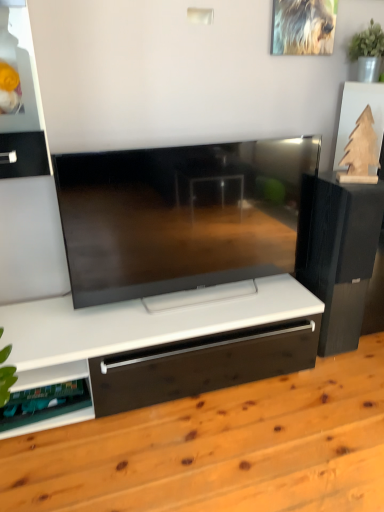
This screenshot has height=512, width=384. I want to click on black matte speaker at right, so click(x=338, y=253).

This screenshot has width=384, height=512. I want to click on black matte speaker at right, so click(x=338, y=253).

Does green plastic shelf at lower left turn towards black matte speaker at right?

No, green plastic shelf at lower left is not aimed at black matte speaker at right.

Between green plastic shelf at lower left and black matte speaker at right, which one has less height?

green plastic shelf at lower left is shorter.

From the image's perspective, is green plastic shelf at lower left above or below black matte speaker at right?

Clearly, from the image's perspective, green plastic shelf at lower left is below black matte speaker at right.

Image resolution: width=384 pixels, height=512 pixels. Identify the location of furniture that is above the green plastic shelf at lower left (from a real-world perspective). (338, 253).

In the scene shown: From a real-world perspective, is wooden floor at center over black matte speaker at right?

No, from a real-world perspective, wooden floor at center is not over black matte speaker at right

Based on the photo, is wooden floor at center positioned with its back to black matte speaker at right?

No.

Is wooden floor at center to the left or to the right of black matte speaker at right in the image?

Based on their positions, wooden floor at center is located to the left of black matte speaker at right.

Is wooden floor at center spatially inside black matte speaker at right, or outside of it?

wooden floor at center lies outside black matte speaker at right.

From a real-world perspective, is black matte speaker at right physically located above or below wooden floor at center?

In terms of real-world spatial position, black matte speaker at right is above wooden floor at center.

Are black matte speaker at right and wooden floor at center located far from each other?

They are positioned close to each other.

Is point (359, 227) positioned before point (375, 339)?

Yes, point (359, 227) is closer to viewer.

From the image's perspective, between black matte speaker at right and wooden floor at center, which one is located above?

black matte speaker at right appears higher in the image.

Is wooden floor at center directly adjacent to green plastic shelf at lower left?

No, wooden floor at center is not beside green plastic shelf at lower left.

Is wooden floor at center bigger than green plastic shelf at lower left?

Yes, wooden floor at center is bigger than green plastic shelf at lower left.

From a real-world perspective, between wooden floor at center and green plastic shelf at lower left, who is vertically higher?

green plastic shelf at lower left is physically above.

Based on the photo, how far apart are wooden floor at center and green plastic shelf at lower left?

The distance of wooden floor at center from green plastic shelf at lower left is 14.50 inches.

Is black matte speaker at right directly adjacent to green plastic shelf at lower left?

No, black matte speaker at right is not touching green plastic shelf at lower left.

Could you tell me if black matte speaker at right is facing green plastic shelf at lower left?

No, black matte speaker at right is not aimed at green plastic shelf at lower left.

Does black matte speaker at right have a greater width compared to green plastic shelf at lower left?

Correct, the width of black matte speaker at right exceeds that of green plastic shelf at lower left.

Locate an element on the screen. This screenshot has height=512, width=384. furniture behind the green plastic shelf at lower left is located at coordinates (338, 253).

Is green plastic shelf at lower left far away from wooden floor at center?

No, green plastic shelf at lower left is not far from wooden floor at center.

Is green plastic shelf at lower left taller or shorter than wooden floor at center?

Clearly, green plastic shelf at lower left is shorter compared to wooden floor at center.

Considering the relative positions of green plastic shelf at lower left and wooden floor at center in the image provided, is green plastic shelf at lower left in front of wooden floor at center?

No, it is not.

This screenshot has width=384, height=512. I want to click on furniture that appears on the right of green plastic shelf at lower left, so click(x=338, y=253).

Where is `furniture behind the wooden floor at center`? This screenshot has width=384, height=512. furniture behind the wooden floor at center is located at coordinates (338, 253).

In the scene shown: Estimate the real-world distances between objects in this image. Which object is further from black matte speaker at right, green plastic shelf at lower left or wooden floor at center?

Among the two, green plastic shelf at lower left is located further to black matte speaker at right.

Considering their positions, is wooden floor at center positioned further to green plastic shelf at lower left than black matte speaker at right?

black matte speaker at right is positioned further to the anchor green plastic shelf at lower left.

Considering their positions, is black matte speaker at right positioned further to green plastic shelf at lower left than wooden floor at center?

black matte speaker at right is further to green plastic shelf at lower left.

Considering their positions, is black matte speaker at right positioned further to wooden floor at center than green plastic shelf at lower left?

black matte speaker at right is further to wooden floor at center.

Based on their spatial positions, is green plastic shelf at lower left or black matte speaker at right further from wooden floor at center?

black matte speaker at right is further to wooden floor at center.

Considering their positions, is wooden floor at center positioned closer to black matte speaker at right than green plastic shelf at lower left?

wooden floor at center.

Locate an element on the screen. hardwood between green plastic shelf at lower left and black matte speaker at right in the horizontal direction is located at coordinates (219, 448).